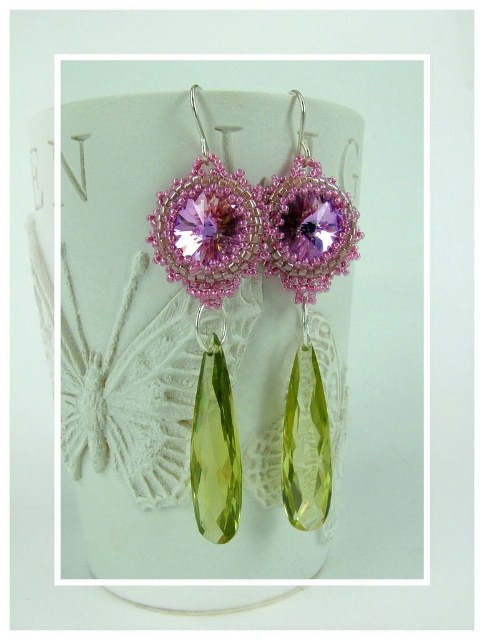
Which is behind, point (312, 166) or point (302, 301)?

Point (302, 301)

Does pink beaded pearl at center come in front of matte pink glass bead at center?

Yes, pink beaded pearl at center is in front of matte pink glass bead at center.

Between point (63, 291) and point (323, 500), which one is positioned in front?

Positioned in front is point (63, 291).

I want to click on pink beaded pearl at center, so click(203, 324).